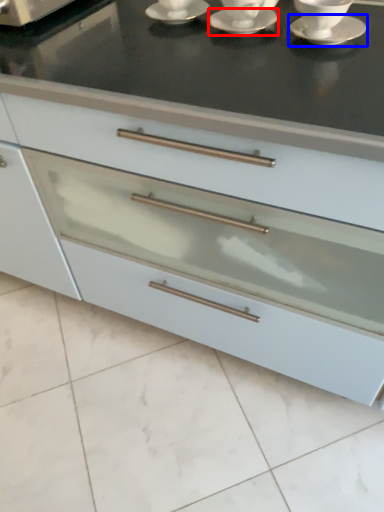
Question: Which of the following is the closest to the observer, saucer (highlighted by a red box) or saucer (highlighted by a blue box)?

Choices:
 (A) saucer
 (B) saucer

Answer: (B)